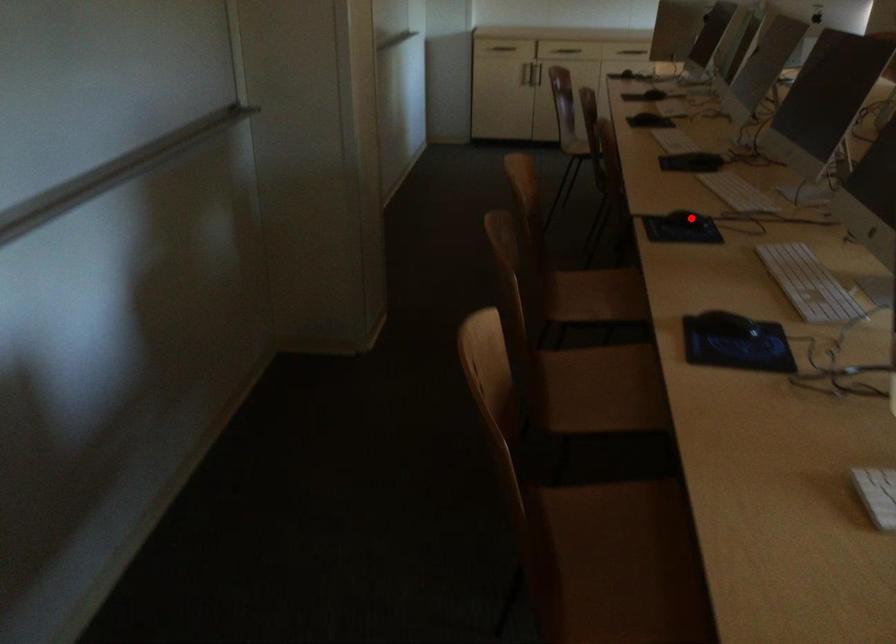
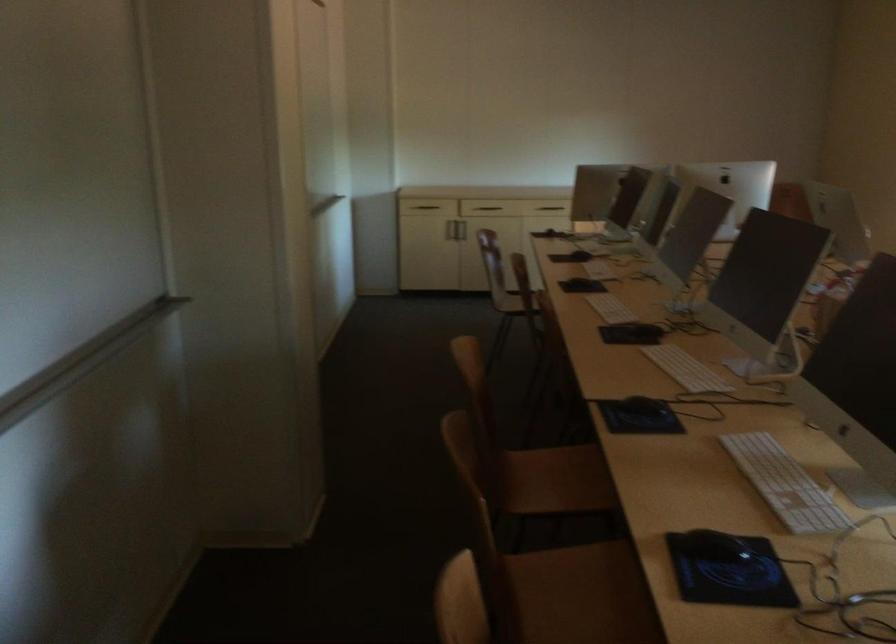
Where in the second image is the point corresponding to the highlighted location from the first image?

(648, 406)